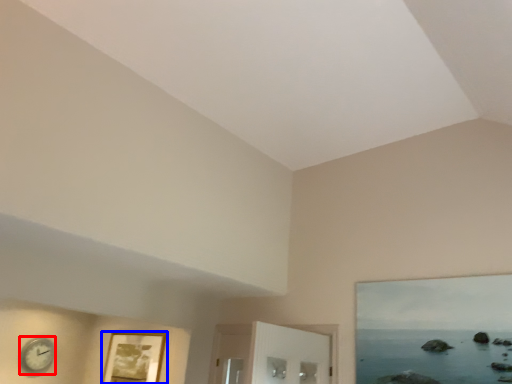
Question: Which of the following is the farthest to the observer, clock (highlighted by a red box) or picture frame (highlighted by a blue box)?

Choices:
 (A) clock
 (B) picture frame

Answer: (A)